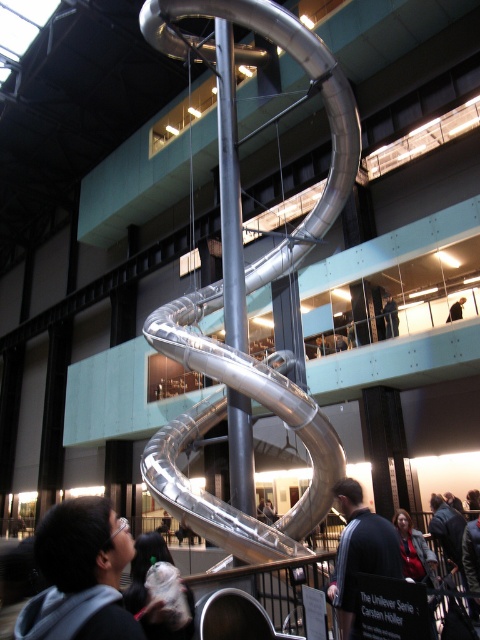
You are standing in the indoor space and want to pick up both the dark gray hoodie at lower left and the dark gray fabric jacket at center. Which item should you reach for first to grab the one closer to you?

The dark gray hoodie at lower left is closer to the viewer, so you should reach for the dark gray hoodie at lower left first.

You are organizing a charity clothing drive and need to pack items into boxes. You have a box that can only hold items narrower than the red sweater at lower right. Can the dark gray fabric jacket at center fit into this box?

The dark gray fabric jacket at center has a lesser width compared to the red sweater at lower right, so it can fit into the box since its width is narrower than the red sweater at lower right.